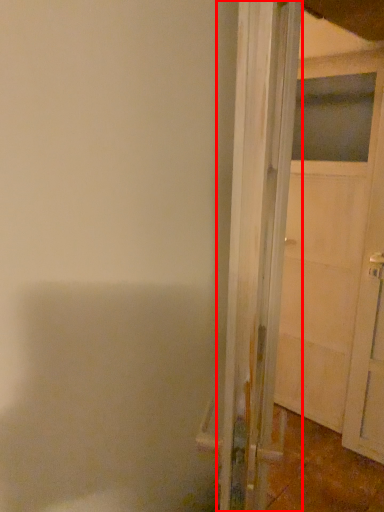
Question: From the image's perspective, where is door (annotated by the red box) located relative to door?

Choices:
 (A) above
 (B) below

Answer: (B)